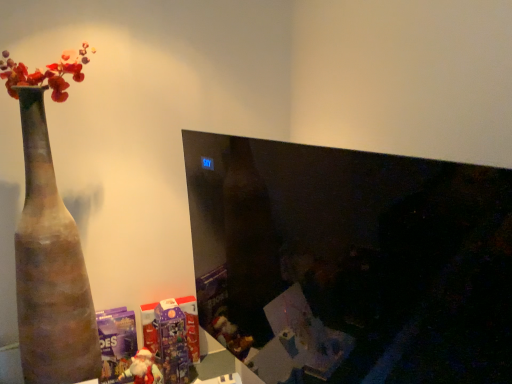
Question: Is terracotta vase at left not near matte plastic santa at lower left, marked as the 2th toy in a back-to-front arrangement?

Choices:
 (A) yes
 (B) no

Answer: (B)

Question: Does terracotta vase at left lie in front of matte plastic santa at lower left, marked as the 2th toy in a back-to-front arrangement?

Choices:
 (A) yes
 (B) no

Answer: (A)

Question: Considering the relative sizes of terracotta vase at left and matte plastic santa at lower left, marked as the 2th toy in a back-to-front arrangement, in the image provided, is terracotta vase at left bigger than matte plastic santa at lower left, marked as the 2th toy in a back-to-front arrangement,?

Choices:
 (A) yes
 (B) no

Answer: (A)

Question: Is the depth of terracotta vase at left greater than that of matte plastic santa at lower left, which ranks as the first toy in front-to-back order?

Choices:
 (A) yes
 (B) no

Answer: (B)

Question: Does terracotta vase at left have a smaller size compared to matte plastic santa at lower left, which ranks as the first toy in front-to-back order?

Choices:
 (A) yes
 (B) no

Answer: (B)

Question: From the image's perspective, is purple glossy advent calendar at lower center, the 1th toy viewed from the back, located above or below terracotta vase at left?

Choices:
 (A) above
 (B) below

Answer: (B)

Question: Looking at the image, does purple glossy advent calendar at lower center, the 1th toy viewed from the back, seem bigger or smaller compared to terracotta vase at left?

Choices:
 (A) small
 (B) big

Answer: (A)

Question: Is purple glossy advent calendar at lower center, the 2th toy when ordered from front to back, spatially inside terracotta vase at left, or outside of it?

Choices:
 (A) inside
 (B) outside

Answer: (B)

Question: Considering the positions of purple glossy advent calendar at lower center, the 1th toy viewed from the back, and terracotta vase at left in the image, is purple glossy advent calendar at lower center, the 1th toy viewed from the back, wider or thinner than terracotta vase at left?

Choices:
 (A) wide
 (B) thin

Answer: (B)

Question: Is black glossy monitor at center in front of or behind terracotta vase at left in the image?

Choices:
 (A) behind
 (B) front

Answer: (B)

Question: Is black glossy monitor at center wider or thinner than terracotta vase at left?

Choices:
 (A) thin
 (B) wide

Answer: (A)

Question: Is point (247, 344) closer or farther from the camera than point (83, 339)?

Choices:
 (A) closer
 (B) farther

Answer: (B)

Question: From the image's perspective, is black glossy monitor at center located above or below terracotta vase at left?

Choices:
 (A) above
 (B) below

Answer: (B)

Question: From a real-world perspective, is purple glossy advent calendar at lower center, the 1th toy viewed from the back, above or below matte plastic santa at lower left, marked as the 2th toy in a back-to-front arrangement?

Choices:
 (A) below
 (B) above

Answer: (B)

Question: From their relative heights in the image, would you say purple glossy advent calendar at lower center, the 1th toy viewed from the back, is taller or shorter than matte plastic santa at lower left, marked as the 2th toy in a back-to-front arrangement?

Choices:
 (A) short
 (B) tall

Answer: (B)